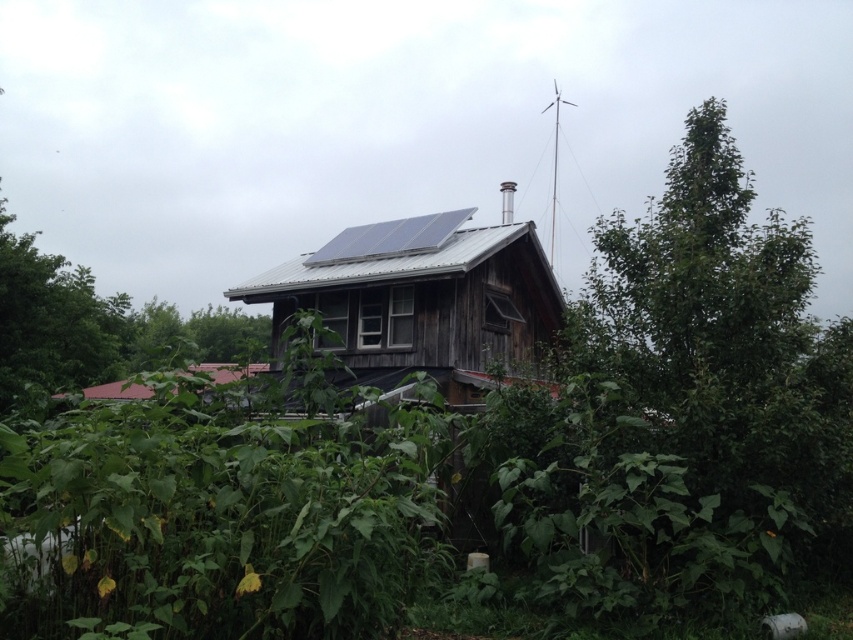
You are a maintenance worker needing to reach the blue metallic solar panel at upper center from the metallic gray hut at center. Given that your ladder is 1.5 meters long, can you safely reach the solar panel without needing a longer ladder?

The distance between the metallic gray hut at center and the blue metallic solar panel at upper center is 1.35 meters. Since your ladder is 1.5 meters long, it is sufficient to safely reach the solar panel without needing a longer ladder.

You are standing in front of the rustic wooden house and want to determine the relative positions of two points marked on the roof. Which point is closer to you, point [430,301] or point [248,364]?

Point [430,301] is further to the viewer than point [248,364], so the point closer to you is point [248,364].